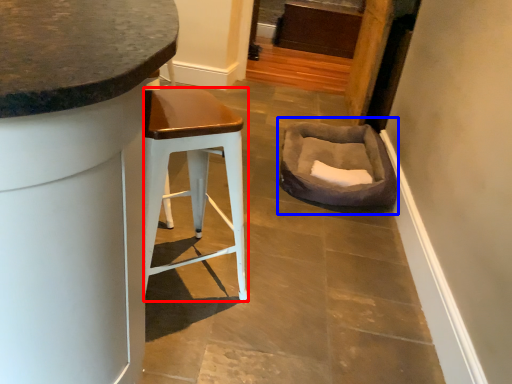
Question: Which of the following is the closest to the observer, stool (highlighted by a red box) or bean bag chair (highlighted by a blue box)?

Choices:
 (A) stool
 (B) bean bag chair

Answer: (A)